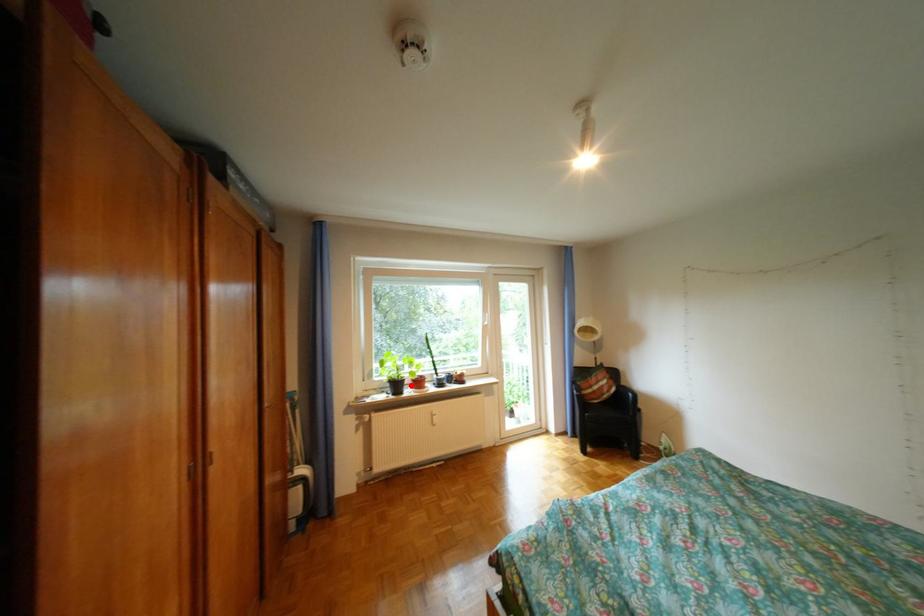
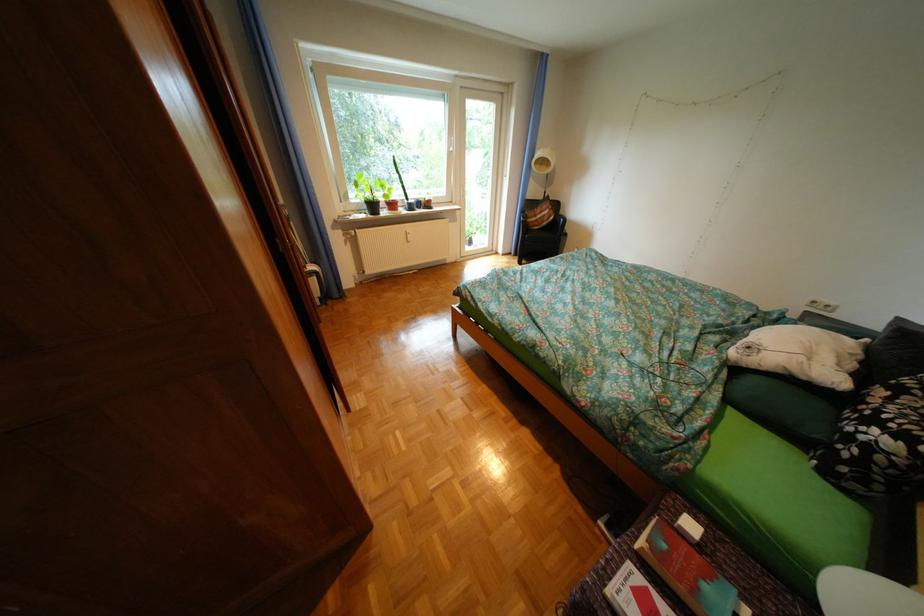
The point at the highlighted location is marked in the first image. Where is the corresponding point in the second image?

(387, 207)